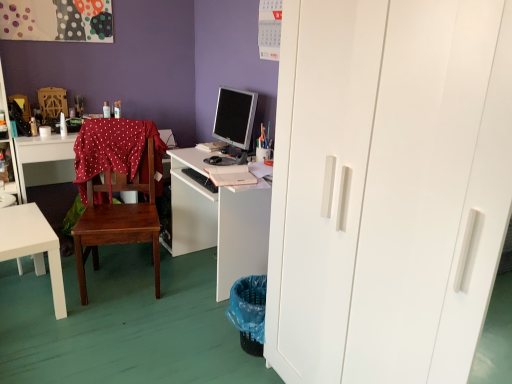
Where is `vacant space in front of white glossy coffee cup at upper left`? vacant space in front of white glossy coffee cup at upper left is located at coordinates (39, 139).